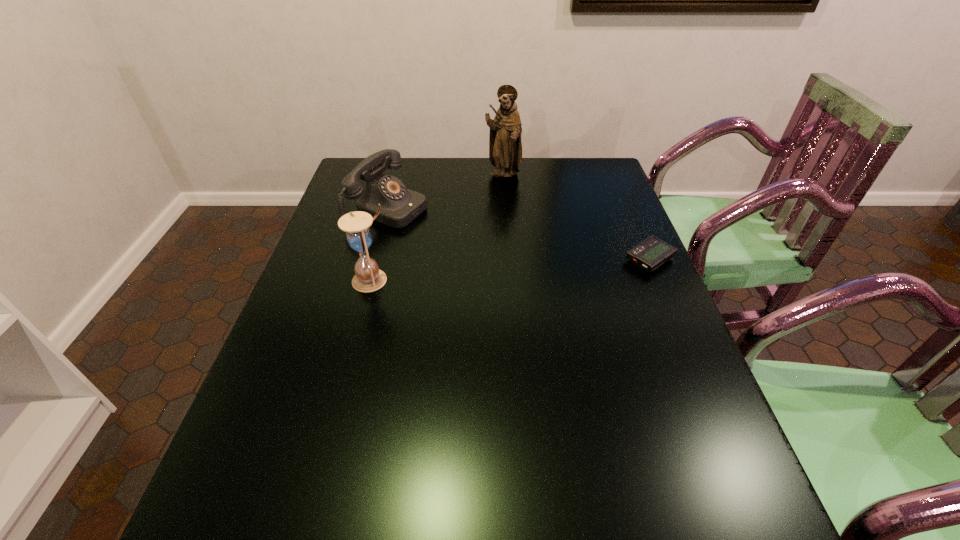
Identify the location of vacant space situated 0.130m on the dial of the third tallest object. 456,234.

I want to click on vacant region located 0.160m on the dial of the third tallest object, so click(465, 237).

The image size is (960, 540). In order to click on vacant space located on the front-facing side of the tallest object in this screenshot , I will do `click(517, 224)`.

Where is `blank space located 0.160m on the front-facing side of the tallest object`? The image size is (960, 540). blank space located 0.160m on the front-facing side of the tallest object is located at coordinates (514, 211).

Locate an element on the screen. Image resolution: width=960 pixels, height=540 pixels. vacant area situated on the front-facing side of the tallest object is located at coordinates (513, 207).

Identify the location of telephone at the far edge. (399, 206).

This screenshot has height=540, width=960. I want to click on figurine that is at the far edge, so click(505, 146).

In order to click on hourglass at the left edge in this screenshot , I will do `click(368, 277)`.

You are a GUI agent. You are given a task and a screenshot of the screen. Output one action in this format:
    pyautogui.click(x=<x>, y=<y>)
    Task: Click on the telephone positioned at the left edge
    
    Given the screenshot: What is the action you would take?
    pyautogui.click(x=399, y=206)

Where is `object that is positioned at the right edge`? Image resolution: width=960 pixels, height=540 pixels. object that is positioned at the right edge is located at coordinates (651, 253).